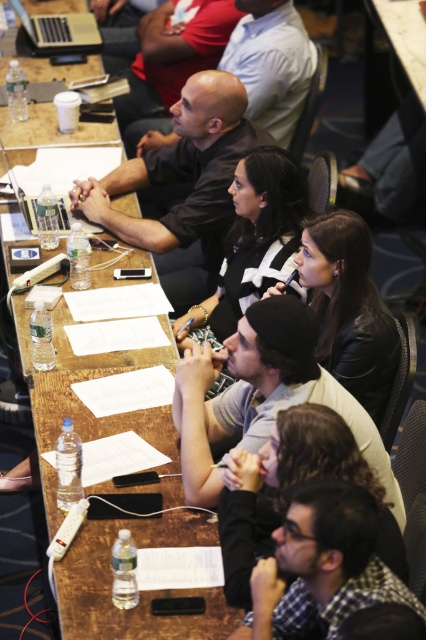
You are sitting at the long wooden table in the conference room. You need to pass a document to the person sitting at point (x=28, y=241). To do this, you decide to slide the document along the table. However, there is an obstacle at point (x=170, y=525). Will the document reach the person?

Point (x=170, y=525) is in front of point (x=28, y=241), so the obstacle at point (x=170, y=525) will block the path to the person at point (x=28, y=241). The document will not reach them.

You are organizing a photo shoot and need to ensure that the checkered fabric shirt at lower right and the clear wood table at center are both visible in the frame. Given their sizes, which object would require a wider shot to fully capture in the photograph?

The clear wood table at center requires a wider shot because it has a greater width than the checkered fabric shirt at lower right.

You are sitting at the long wooden table in the conference room. You want to pass a document to the person sitting at point (x=63, y=305). There is an object at point (x=316, y=579) blocking your path. Can you reach the person without moving the object?

Point (x=316, y=579) is in front of point (x=63, y=305), so the object at point (x=316, y=579) is blocking the path to the person at point (x=63, y=305). Therefore, you cannot reach the person without moving the object.